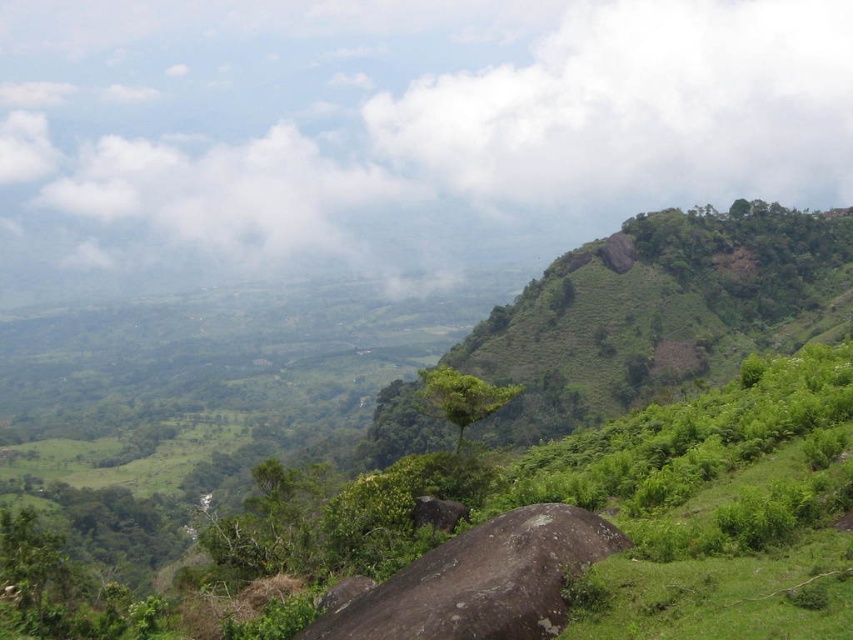
Question: Can you confirm if gray rough boulder at center is smaller than green leafy tree at center?

Choices:
 (A) yes
 (B) no

Answer: (A)

Question: Is gray rough boulder at center positioned at the back of green leafy tree at center?

Choices:
 (A) no
 (B) yes

Answer: (A)

Question: In this image, where is gray rough boulder at center located relative to green leafy tree at center?

Choices:
 (A) left
 (B) right

Answer: (B)